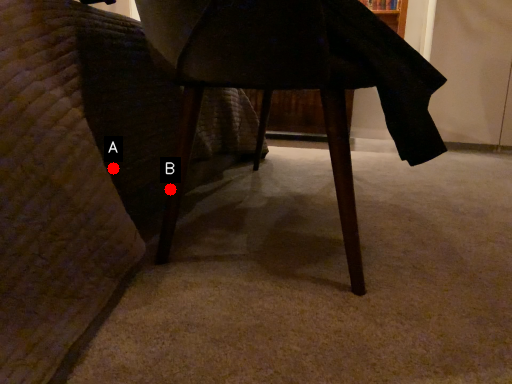
Question: Two points are circled on the image, labeled by A and B beside each circle. Which point is farther from the camera taking this photo?

Choices:
 (A) A is further
 (B) B is further

Answer: (A)